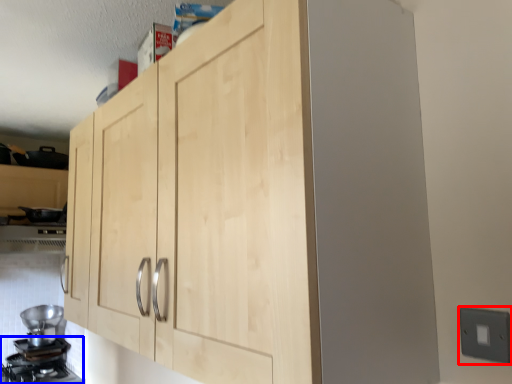
Question: Which object is closer to the camera taking this photo, electric outlet (highlighted by a red box) or gas stove (highlighted by a blue box)?

Choices:
 (A) electric outlet
 (B) gas stove

Answer: (A)